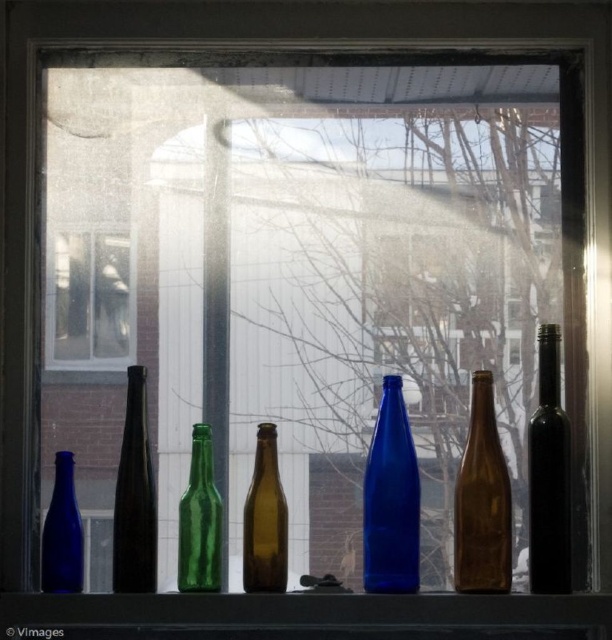
You are a photographer standing 5 feet away from the window. You want to take a closeup photo of the matte glass bottles at center. Can you reach them without moving closer than your current position?

The matte glass bottles at center are 4.80 feet away from the camera, so yes, you can reach them without moving closer than your current position since you are already 5 feet away.

You are a photographer trying to capture a closeup of the bottles on the windowsill. You have a camera with a focus range that can only focus on objects within 1 meter. The two points you are focusing on are point (483, 588) and point (211, 544). Which point should you focus on to ensure the bottles are in focus?

You should focus on point (483, 588) because it is closer to the camera than point (211, 544), so it falls within the focus range of 1 meter.

You are organizing bottles on a windowsill and need to place a new bottle between the black glass bottle at right and the matte blue bottle at left. Can you fit it there?

The black glass bottle at right is to the right of the matte blue bottle at left, so there is space between them to place the new bottle.